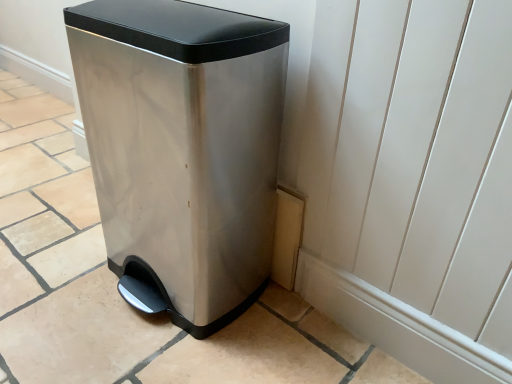
Locate an element on the screen. stainless steel trash can at lower left is located at coordinates (183, 148).

Image resolution: width=512 pixels, height=384 pixels. Describe the element at coordinates (183, 148) in the screenshot. I see `stainless steel trash can at lower left` at that location.

This screenshot has height=384, width=512. I want to click on stainless steel trash can at lower left, so click(x=183, y=148).